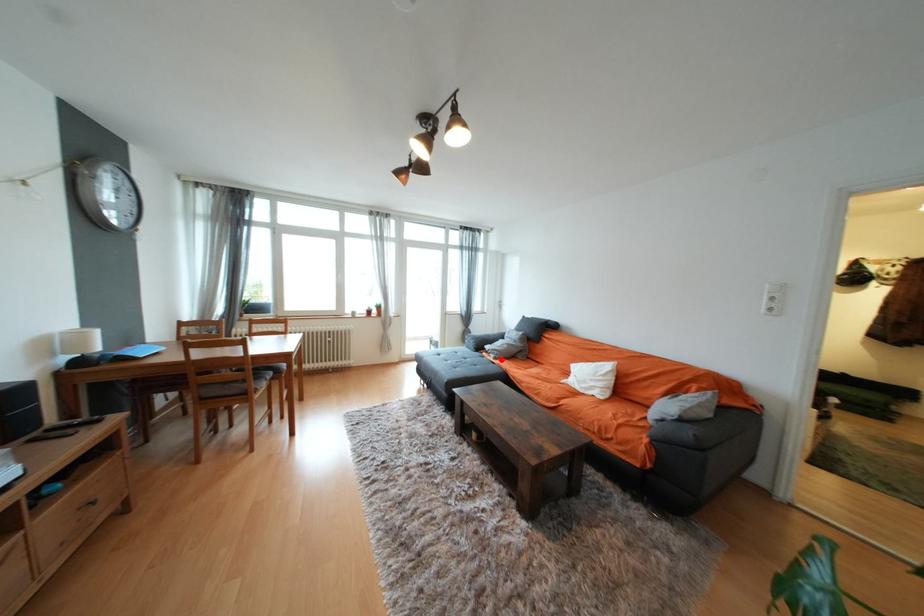
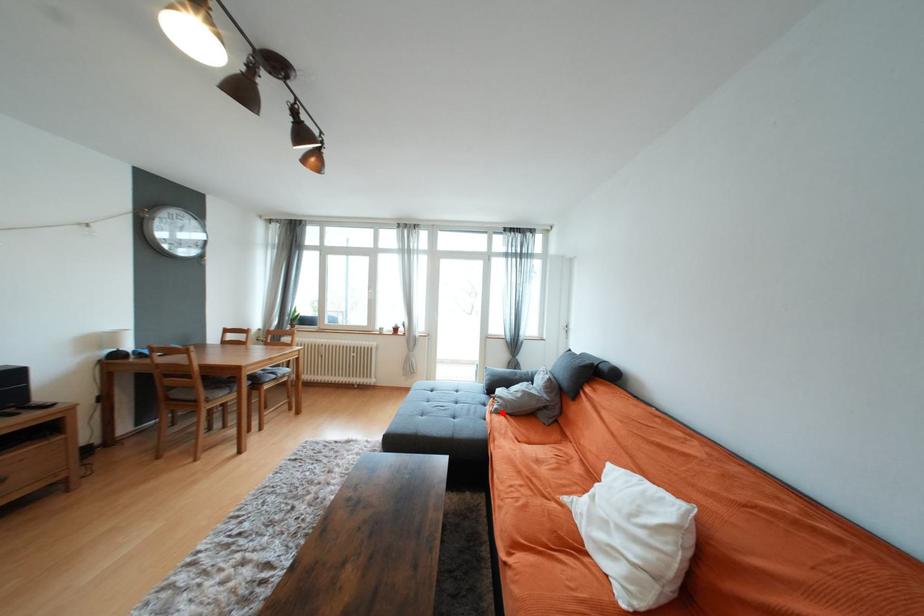
Consider the image. I am providing you with two images of the same scene from different viewpoints. A red point is marked on the first image and another point is marked on the second image. Is the red point in image1 aligned with the point shown in image2?

Yes